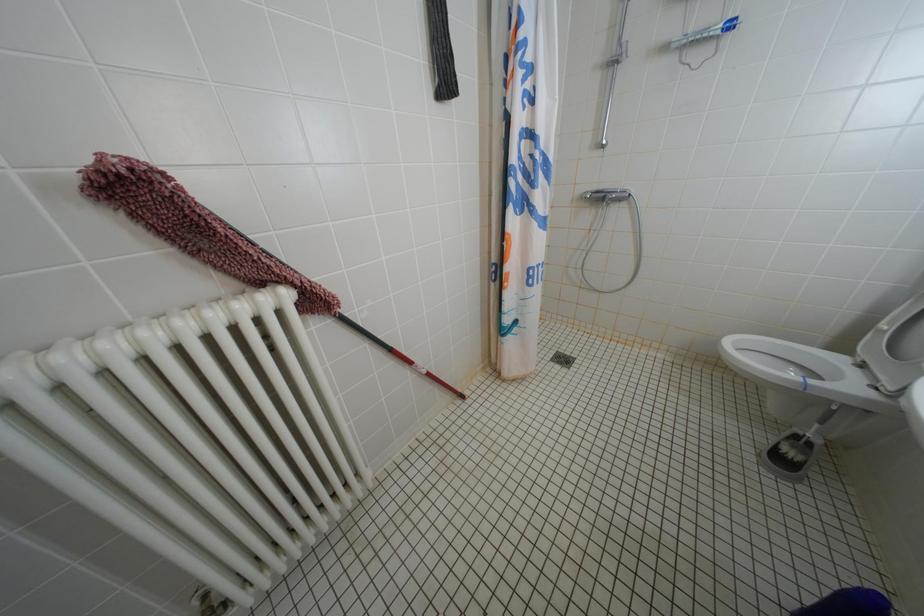
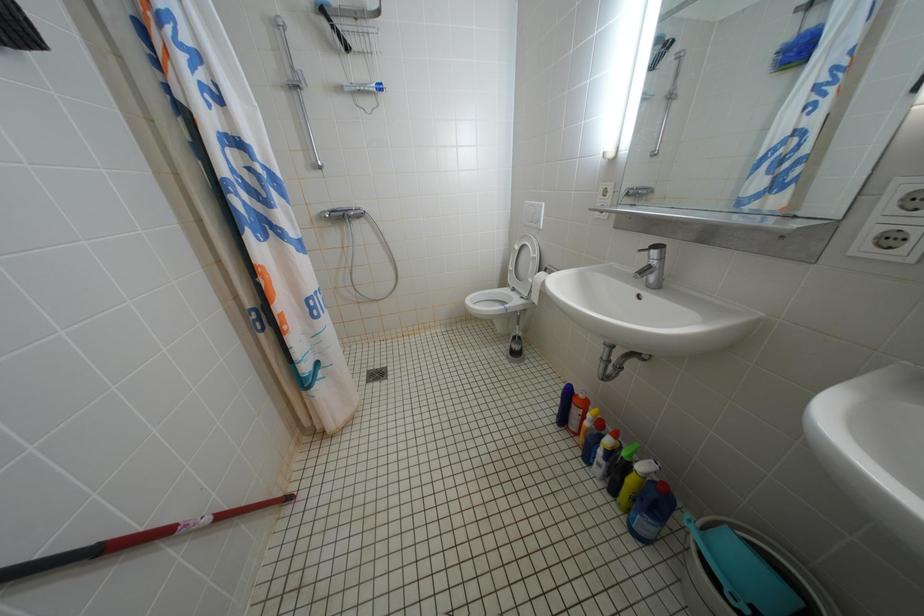
Question: The images are taken continuously from a first-person perspective. In which direction is your viewpoint rotating?

Choices:
 (A) Left
 (B) Right
 (C) Up
 (D) Down

Answer: (B)